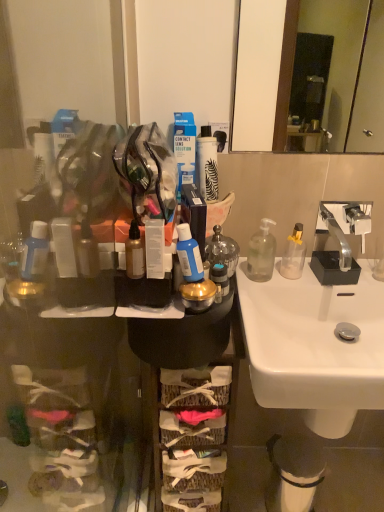
Question: Would you say blue matte bottle at center is inside or outside transparent plastic soap dispenser at right, which ranks as the 3th bottle in left-to-right order?

Choices:
 (A) outside
 (B) inside

Answer: (A)

Question: Is point (192, 240) closer or farther from the camera than point (273, 252)?

Choices:
 (A) closer
 (B) farther

Answer: (A)

Question: Which object is positioned closest to the woven fabric basket at center?

Choices:
 (A) white plastic trash can at lower right
 (B) transparent plastic bottle at sink, which is counted as the fourth bottle, starting from the left
 (C) translucent glass bottle at center, the 2th bottle viewed from the left
 (D) blue plastic contact lens solution at center
 (E) white glossy sink at center

Answer: (E)

Question: Which object is positioned closest to the blue matte bottle at center?

Choices:
 (A) transparent plastic soap dispenser at right, acting as the second bottle starting from the right
 (B) blue plastic contact lens solution at center
 (C) translucent glass bottle at center, the 2th bottle viewed from the left
 (D) transparent plastic bottle at sink, arranged as the first bottle when viewed from the right
 (E) white plastic trash can at lower right

Answer: (C)